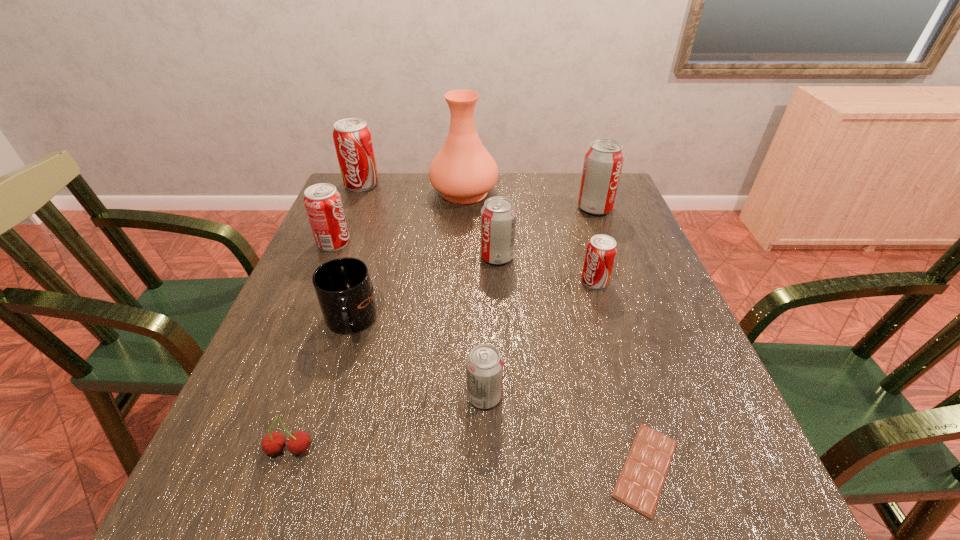
At what (x,y) coordinates should I click in order to perform the action: click on vacant space located with the handle on the side of the fourth nearest object. Please return your answer as a coordinate pair (x, y). Looking at the image, I should click on (329, 391).

Find the location of a particular element. The width and height of the screenshot is (960, 540). free space located on the back of the smallest red soda can is located at coordinates (580, 230).

The height and width of the screenshot is (540, 960). I want to click on vacant space situated 0.250m on the right of the nearest gray soda can, so click(638, 396).

Identify the location of vacant region located 0.090m on the surface of the cherry. (266, 519).

You are a GUI agent. You are given a task and a screenshot of the screen. Output one action in this format:
    pyautogui.click(x=<x>, y=<y>)
    Task: Click on the vacant space situated on the left of the shortest object
    
    Given the screenshot: What is the action you would take?
    pyautogui.click(x=530, y=468)

Image resolution: width=960 pixels, height=540 pixels. Identify the location of vase at the far edge. (463, 171).

Image resolution: width=960 pixels, height=540 pixels. What are the coordinates of `object located in the near edge section of the desktop` in the screenshot? It's located at (639, 486).

The height and width of the screenshot is (540, 960). Identify the location of mug located in the left edge section of the desktop. (343, 286).

At what (x,y) coordinates should I click in order to perform the action: click on cherry present at the left edge. Please return your answer as a coordinate pair (x, y). Looking at the image, I should click on (273, 443).

This screenshot has height=540, width=960. What are the coordinates of `chocolate bar that is at the right edge` in the screenshot? It's located at (639, 486).